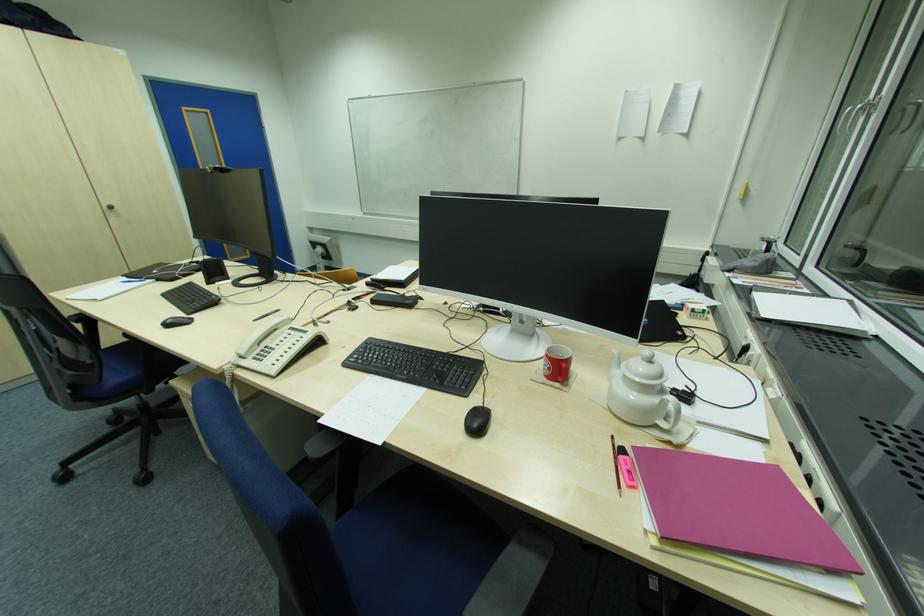
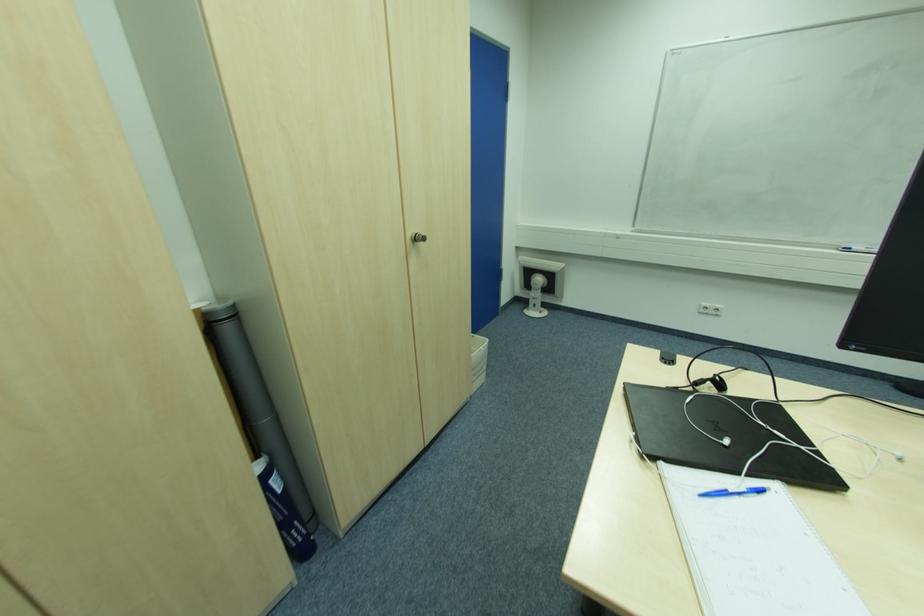
Where in the second image is the point corresponding to (x=193, y=264) from the first image?

(699, 385)